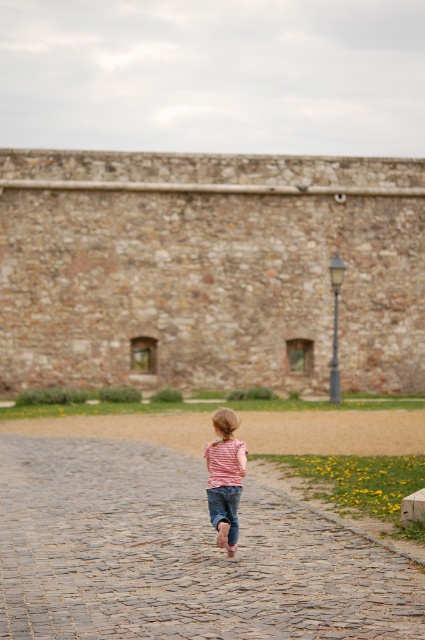
Is point (350, 285) closer to viewer compared to point (119, 476)?

No, (350, 285) is further to viewer.

Who is more forward, (206, 273) or (190, 588)?

Point (190, 588) is in front.

Identify the location of stone wall at upper center. The width and height of the screenshot is (425, 640). (209, 269).

Does stone wall at upper center have a greater width compared to striped fabric shirt at center?

Indeed, stone wall at upper center has a greater width compared to striped fabric shirt at center.

Can you confirm if stone wall at upper center is shorter than striped fabric shirt at center?

No, stone wall at upper center is not shorter than striped fabric shirt at center.

At what (x,y) coordinates should I click in order to perform the action: click on stone wall at upper center. Please return your answer as a coordinate pair (x, y). Looking at the image, I should click on (209, 269).

Which is above, cobblestone path at center or jeans at center?

jeans at center is higher up.

Is point (139, 577) positioned behind point (229, 496)?

No, it is in front of (229, 496).

Find the location of a particular element. This screenshot has height=640, width=425. cobblestone path at center is located at coordinates (178, 554).